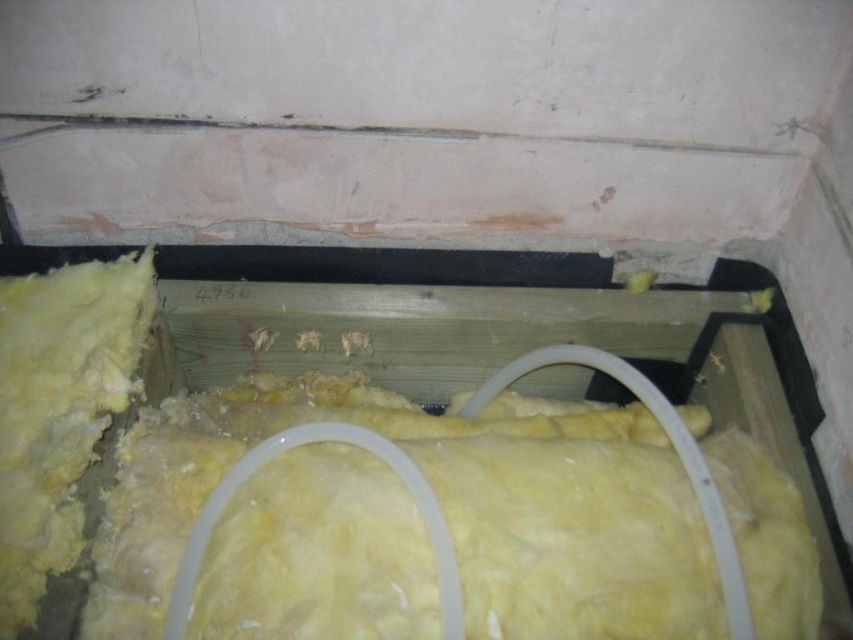
Which is above, yellow fiberglass insulation at center or yellow wool insulation at left?

yellow wool insulation at left is above.

Who is taller, yellow fiberglass insulation at center or yellow wool insulation at left?

yellow wool insulation at left is taller.

Is point (807, 588) less distant than point (19, 356)?

Yes, point (807, 588) is closer to viewer.

Locate an element on the screen. The height and width of the screenshot is (640, 853). yellow fiberglass insulation at center is located at coordinates (445, 515).